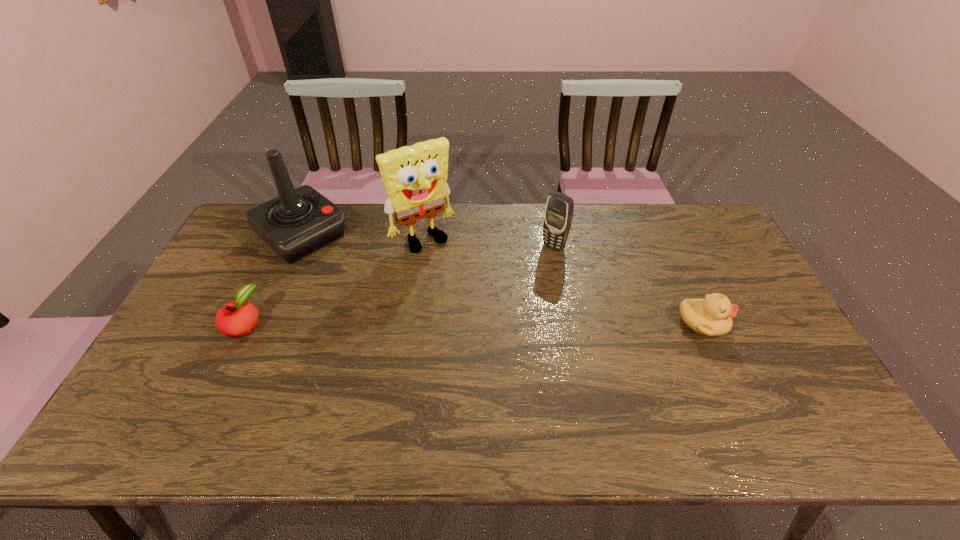
Point out which object is positioned as the third nearest to the joystick. Please provide its 2D coordinates. Your answer should be formatted as a tuple, i.e. [(x, y)], where the tuple contains the x and y coordinates of a point satisfying the conditions above.

[(558, 215)]

This screenshot has height=540, width=960. In order to click on free space that satisfies the following two spatial constraints: 1. on the front side of the third shortest object; 2. on the left side of the joystick in this screenshot , I will do `click(298, 246)`.

Image resolution: width=960 pixels, height=540 pixels. I want to click on vacant space that satisfies the following two spatial constraints: 1. on the front side of the second shortest object; 2. on the beak of the apple, so click(244, 323).

This screenshot has height=540, width=960. I want to click on free space that satisfies the following two spatial constraints: 1. on the front side of the sponge; 2. on the left side of the cellular telephone, so click(422, 246).